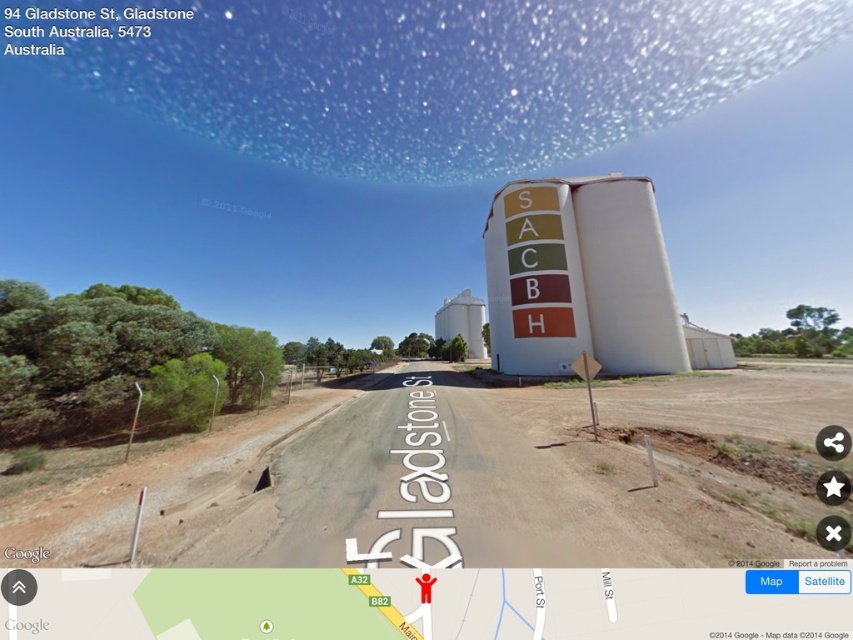
At what (x,y) coordinates should I click in order to perform the action: click on white matte silo at center. Please return your answer as a coordinate pair (x, y). The width and height of the screenshot is (853, 640). Looking at the image, I should click on (579, 276).

Is white matte silo at center shorter than white matte water tower at center?

Correct, white matte silo at center is not as tall as white matte water tower at center.

Where is `white matte silo at center`? The image size is (853, 640). white matte silo at center is located at coordinates (579, 276).

Is brown dirt track at lower left to the left of white matte silo at center from the viewer's perspective?

Indeed, brown dirt track at lower left is positioned on the left side of white matte silo at center.

Is brown dirt track at lower left smaller than white matte silo at center?

Yes, brown dirt track at lower left is smaller than white matte silo at center.

Which is in front, point (128, 476) or point (648, 340)?

Point (128, 476) is more forward.

Find the location of a particular element. brown dirt track at lower left is located at coordinates (425, 488).

Is brown dirt track at lower left positioned at the back of white matte water tower at center?

No.

Describe the element at coordinates (425, 488) in the screenshot. I see `brown dirt track at lower left` at that location.

Locate an element on the screen. The image size is (853, 640). brown dirt track at lower left is located at coordinates (425, 488).

The height and width of the screenshot is (640, 853). Identify the location of brown dirt track at lower left. (425, 488).